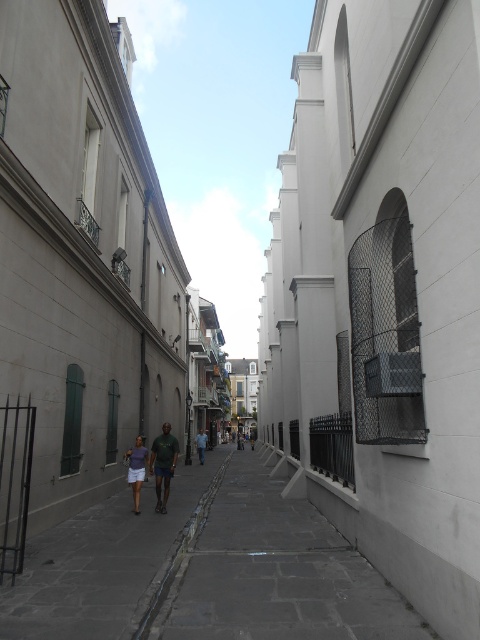
Question: Which of the following is the farthest from the observer?

Choices:
 (A) (193, 490)
 (B) (199, 438)
 (C) (126, 452)

Answer: (B)

Question: Can you confirm if dark gray concrete pavement at center is wider than blue denim jeans at center?

Choices:
 (A) yes
 (B) no

Answer: (A)

Question: Can you confirm if matte purple shorts at center is positioned below blue denim jeans at center?

Choices:
 (A) yes
 (B) no

Answer: (B)

Question: Which is nearer to the matte purple shorts at center?

Choices:
 (A) matte purple shirt at center
 (B) blue denim jeans at center

Answer: (A)

Question: Does dark gray concrete pavement at center appear under blue denim jeans at center?

Choices:
 (A) yes
 (B) no

Answer: (B)

Question: Which object is closer to the camera taking this photo?

Choices:
 (A) matte purple shirt at center
 (B) matte purple shorts at center
 (C) dark gray concrete pavement at center
 (D) blue denim jeans at center

Answer: (C)